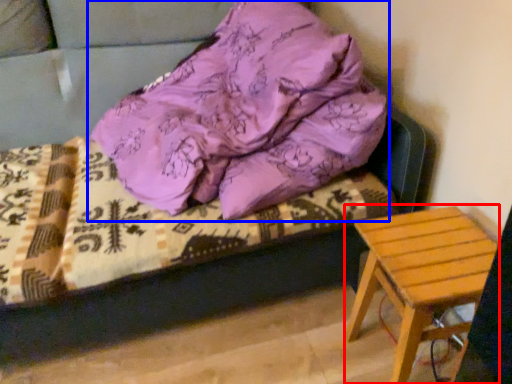
Question: Which point is closer to the camera, stool (highlighted by a red box) or pillow (highlighted by a blue box)?

Choices:
 (A) stool
 (B) pillow

Answer: (B)